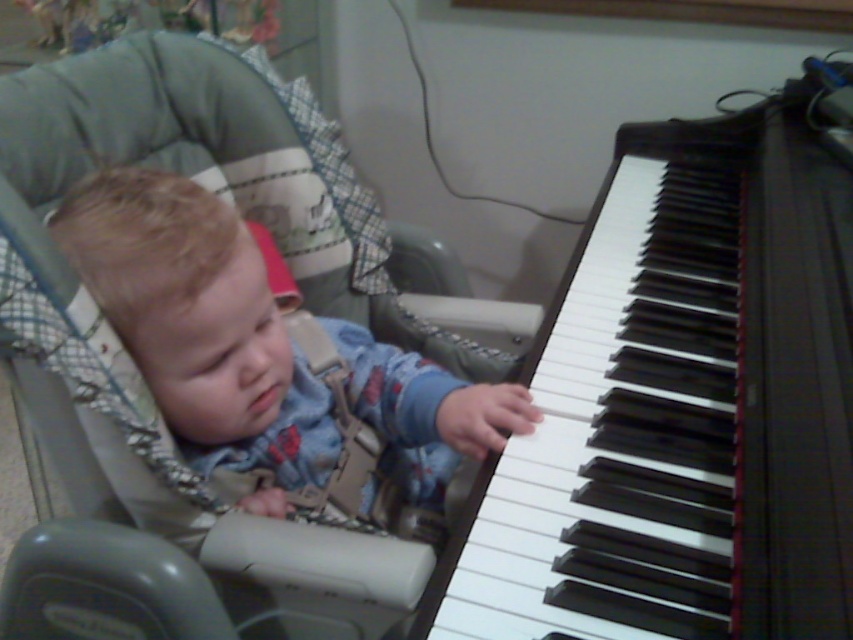
Question: Which of the following is the farthest from the observer?

Choices:
 (A) white glossy piano keys at right
 (B) blue denim jumpsuit at center

Answer: (B)

Question: Does white glossy piano keys at right appear on the left side of blue denim jumpsuit at center?

Choices:
 (A) no
 (B) yes

Answer: (A)

Question: Among these objects, which one is nearest to the camera?

Choices:
 (A) blue denim jumpsuit at center
 (B) white glossy piano keys at right

Answer: (B)

Question: Can you confirm if white glossy piano keys at right is positioned to the right of blue denim jumpsuit at center?

Choices:
 (A) no
 (B) yes

Answer: (B)

Question: Does white glossy piano keys at right appear over blue denim jumpsuit at center?

Choices:
 (A) yes
 (B) no

Answer: (A)